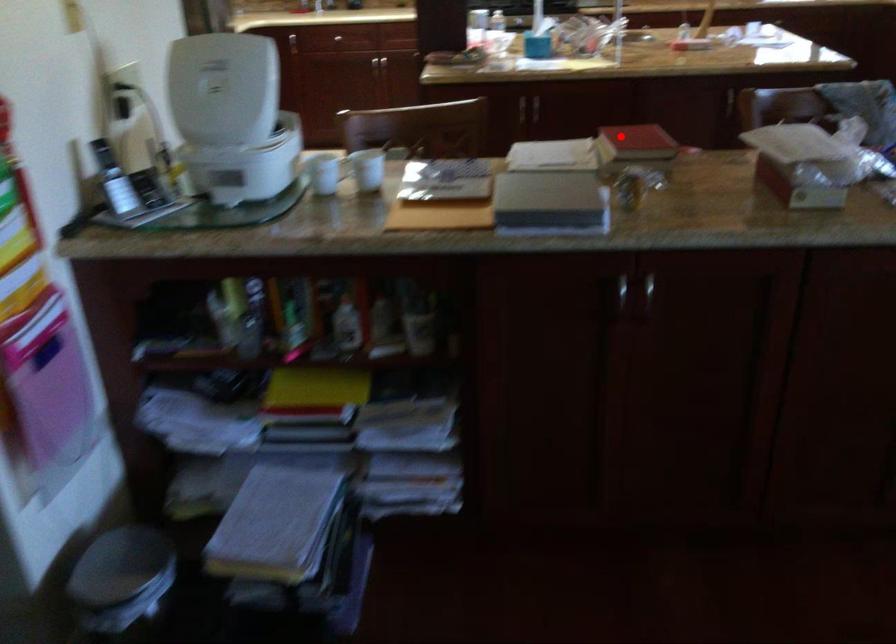
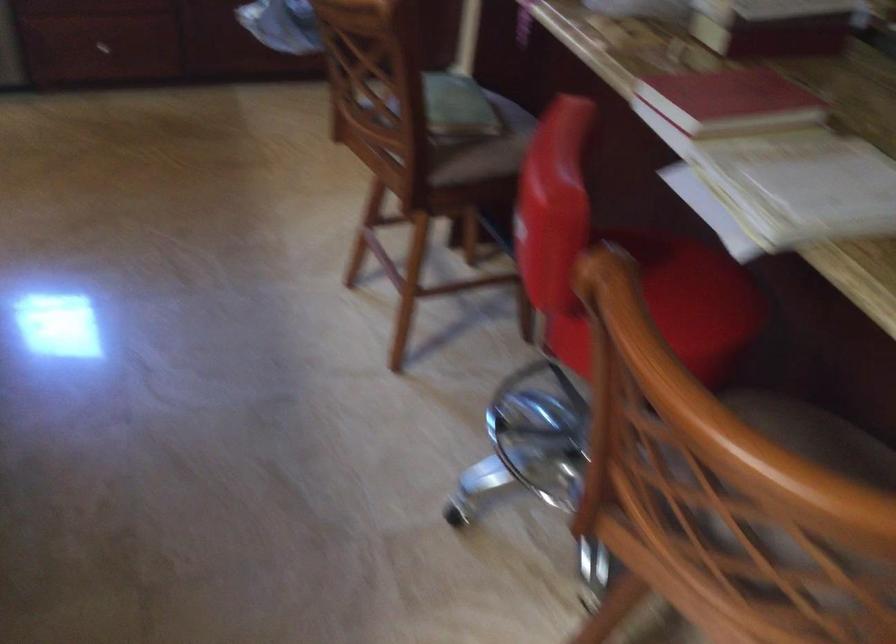
Question: A red point is marked in image1. In image2, is the corresponding 3D point closer to the camera or farther? Reply with the corresponding letter.

Choices:
 (A) The corresponding 3D point is closer.
 (B) The corresponding 3D point is farther.

Answer: (A)